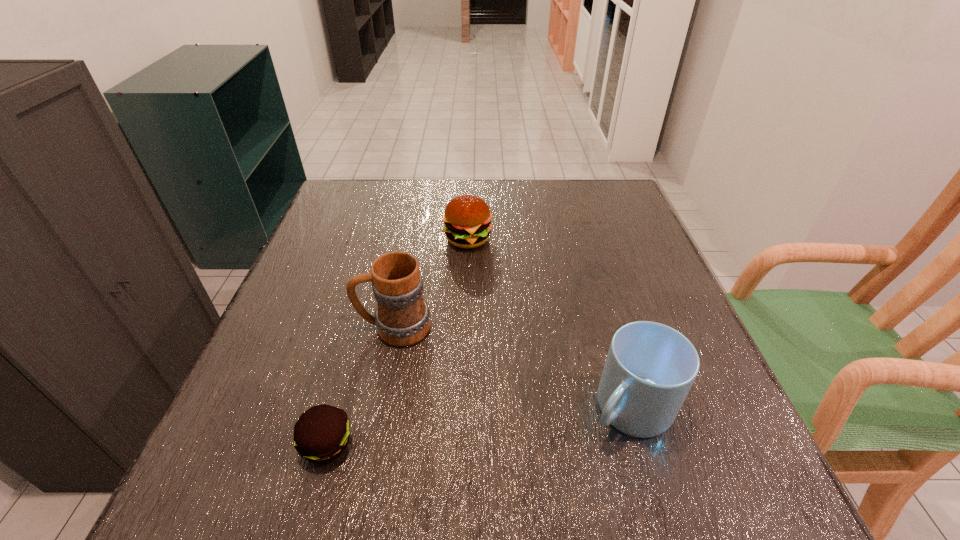
Where is `the second farthest object`? The width and height of the screenshot is (960, 540). the second farthest object is located at coordinates (402, 317).

This screenshot has height=540, width=960. Identify the location of the left mug. (402, 317).

Identify the location of the rightmost object. (650, 368).

This screenshot has height=540, width=960. I want to click on the right mug, so click(x=650, y=368).

Where is `hamburger`? This screenshot has height=540, width=960. hamburger is located at coordinates (467, 218).

Where is `the second shortest object`? The image size is (960, 540). the second shortest object is located at coordinates (467, 218).

Where is `the shortest object`? The image size is (960, 540). the shortest object is located at coordinates (321, 434).

The height and width of the screenshot is (540, 960). I want to click on vacant area located on the side of the left mug with the handle, so click(316, 327).

You are a GUI agent. You are given a task and a screenshot of the screen. Output one action in this format:
    pyautogui.click(x=<x>, y=<y>)
    Task: Click on the vacant space located on the back of the right mug
    The height and width of the screenshot is (540, 960).
    Given the screenshot: What is the action you would take?
    pyautogui.click(x=594, y=289)

Image resolution: width=960 pixels, height=540 pixels. I want to click on vacant region located 0.180m on the front of the hamburger, so pos(466,308).